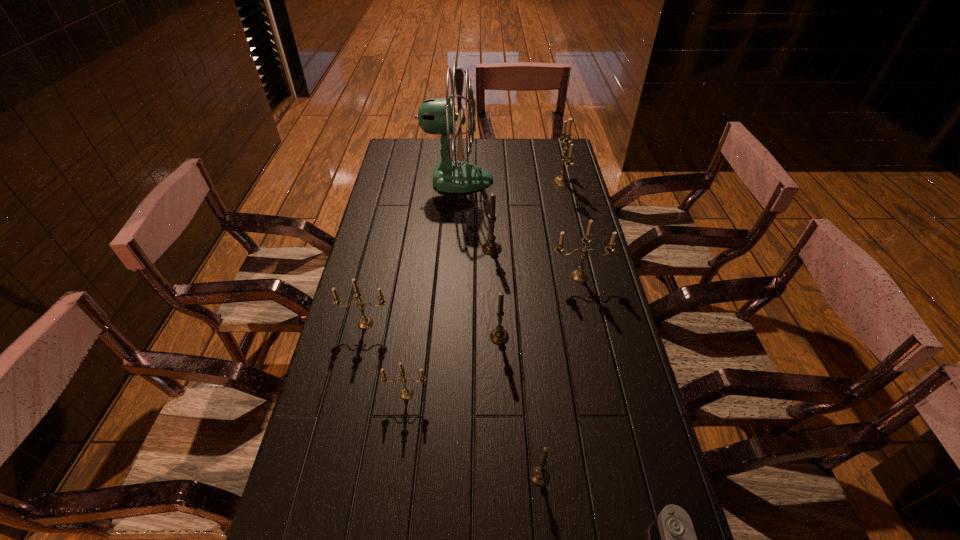
This screenshot has width=960, height=540. Find the location of `vacant area that satisfies the following two spatial constraints: 1. in front of the sixth nearest object, directing airflow; 2. on the left side of the teal fan`. vacant area that satisfies the following two spatial constraints: 1. in front of the sixth nearest object, directing airflow; 2. on the left side of the teal fan is located at coordinates (451, 276).

This screenshot has height=540, width=960. I want to click on free spot that satisfies the following two spatial constraints: 1. in front of the fan, directing airflow; 2. on the back side of the second biggest metallic candle, so click(451, 276).